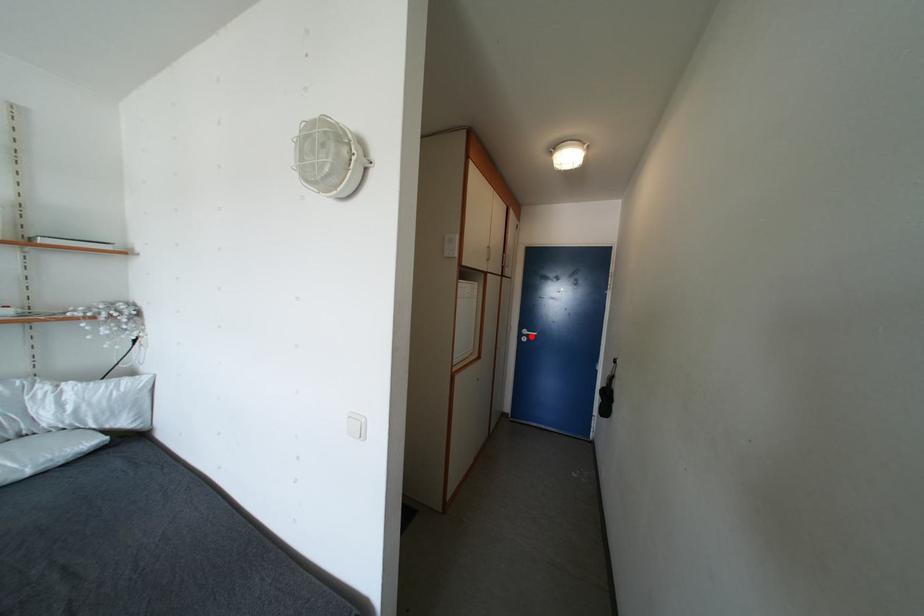
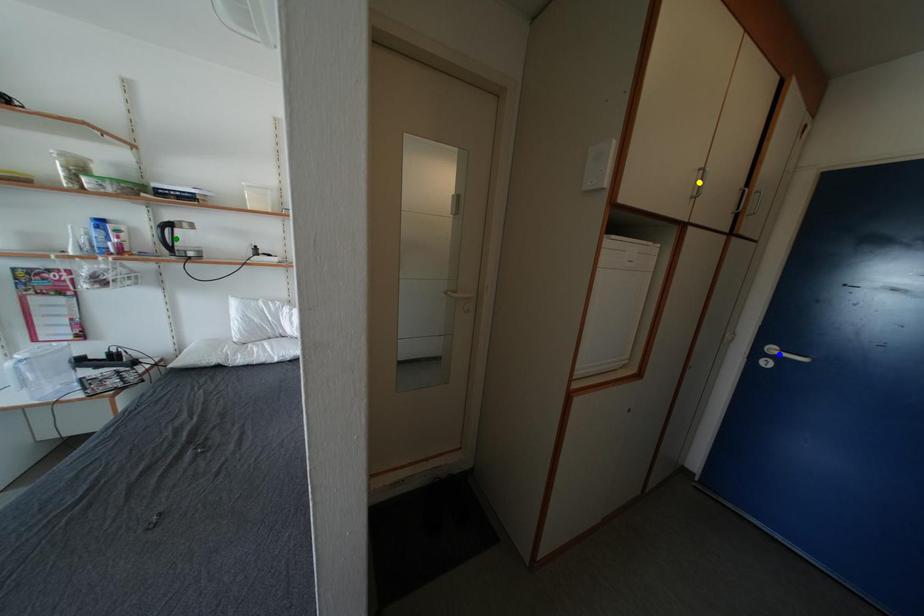
Question: I am providing you with two images of the same scene from different viewpoints. A red point is marked on the first image. You are given multiple points on the second image. Which point in image 2 represents the same 3d spot as the red point in image 1?

Choices:
 (A) green point
 (B) blue point
 (C) yellow point

Answer: (B)